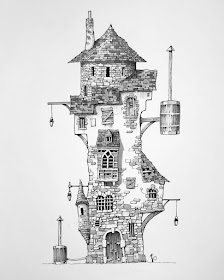
You are a GUI agent. You are given a task and a screenshot of the screen. Output one action in this format:
    pyautogui.click(x=<x>, y=<y>)
    Task: Click on the window
    This screenshot has width=224, height=280.
    Given the screenshot: What is the action you would take?
    tap(82, 210)